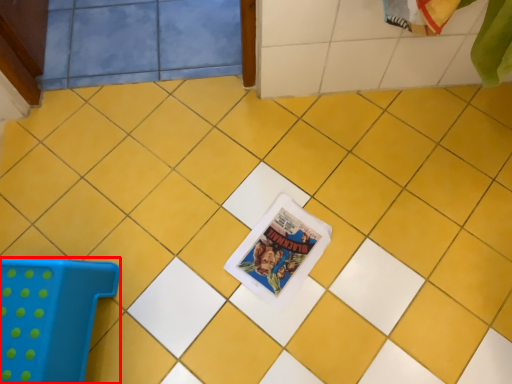
Question: From the image, what is the correct spatial relationship of furniture (annotated by the red box) in relation to comic book?

Choices:
 (A) left
 (B) right

Answer: (A)